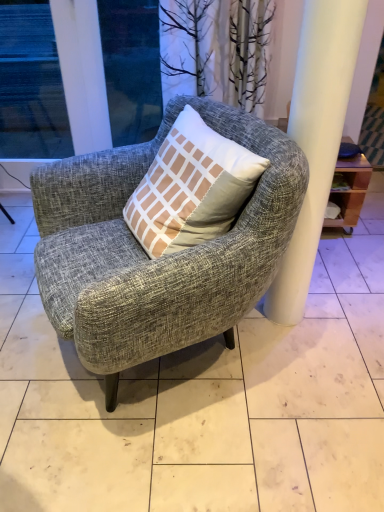
Question: Is transparent glass window at upper left, the second window when ordered from right to left, wider or thinner than textured gray armchair at center?

Choices:
 (A) thin
 (B) wide

Answer: (A)

Question: From a real-world perspective, is transparent glass window at upper left, the second window when ordered from right to left, physically located above or below textured gray armchair at center?

Choices:
 (A) below
 (B) above

Answer: (B)

Question: Which of these objects is positioned farthest from the textured gray armchair at center?

Choices:
 (A) gray fabric chair at center
 (B) transparent glass window at upper left, which is the second window in left-to-right order
 (C) transparent glass window at upper left, the second window when ordered from right to left

Answer: (C)

Question: Estimate the real-world distances between objects in this image. Which object is closer to the transparent glass window at upper left, positioned as the first window in right-to-left order?

Choices:
 (A) textured gray armchair at center
 (B) gray fabric chair at center
 (C) transparent glass window at upper left, which ranks as the 1th window in left-to-right order

Answer: (C)